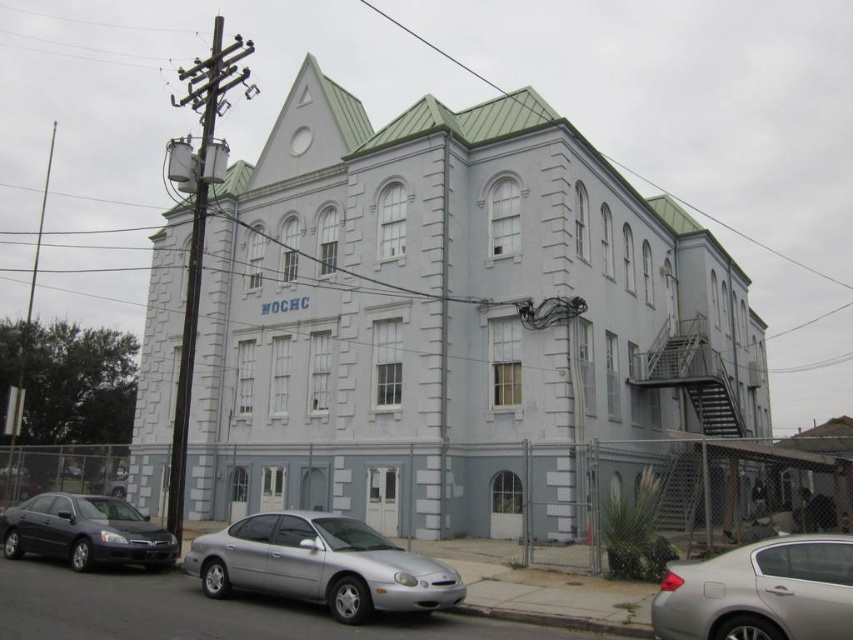
Question: Which point is farther to the camera?

Choices:
 (A) (763, 628)
 (B) (372, 596)

Answer: (B)

Question: Considering the real-world distances, which object is closest to the shiny black sedan at lower left?

Choices:
 (A) satin silver sedan at lower right
 (B) silver metallic sedan at center

Answer: (B)

Question: Can you confirm if silver metallic sedan at center is smaller than shiny black sedan at lower left?

Choices:
 (A) yes
 (B) no

Answer: (A)

Question: Does silver metallic sedan at center have a larger size compared to shiny black sedan at lower left?

Choices:
 (A) no
 (B) yes

Answer: (A)

Question: Which point is farther to the camera?

Choices:
 (A) (809, 600)
 (B) (280, 572)

Answer: (B)

Question: Is silver metallic sedan at center to the left of satin silver sedan at lower right from the viewer's perspective?

Choices:
 (A) no
 (B) yes

Answer: (B)